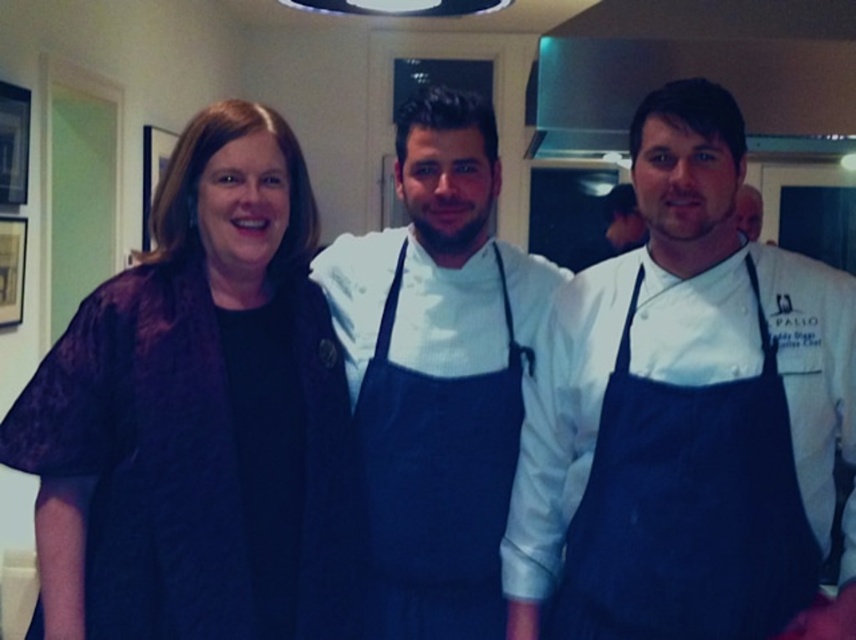
Question: Which point is farther from the camera taking this photo?

Choices:
 (A) (486, 445)
 (B) (610, 452)
 (C) (235, 346)

Answer: (A)

Question: Which point is closer to the camera taking this photo?

Choices:
 (A) (705, 456)
 (B) (364, 292)
 (C) (212, 324)
 (D) (565, 140)

Answer: (A)

Question: Does dark blue fabric apron at right lie in front of stainless steel exhaust hood at upper center?

Choices:
 (A) no
 (B) yes

Answer: (B)

Question: Can you confirm if dark purple fabric at left is positioned below blue fabric apron at center?

Choices:
 (A) yes
 (B) no

Answer: (B)

Question: Can you confirm if dark purple fabric at left is thinner than blue fabric apron at center?

Choices:
 (A) yes
 (B) no

Answer: (B)

Question: Estimate the real-world distances between objects in this image. Which object is farther from the stainless steel exhaust hood at upper center?

Choices:
 (A) dark blue fabric apron at right
 (B) blue fabric apron at center

Answer: (A)